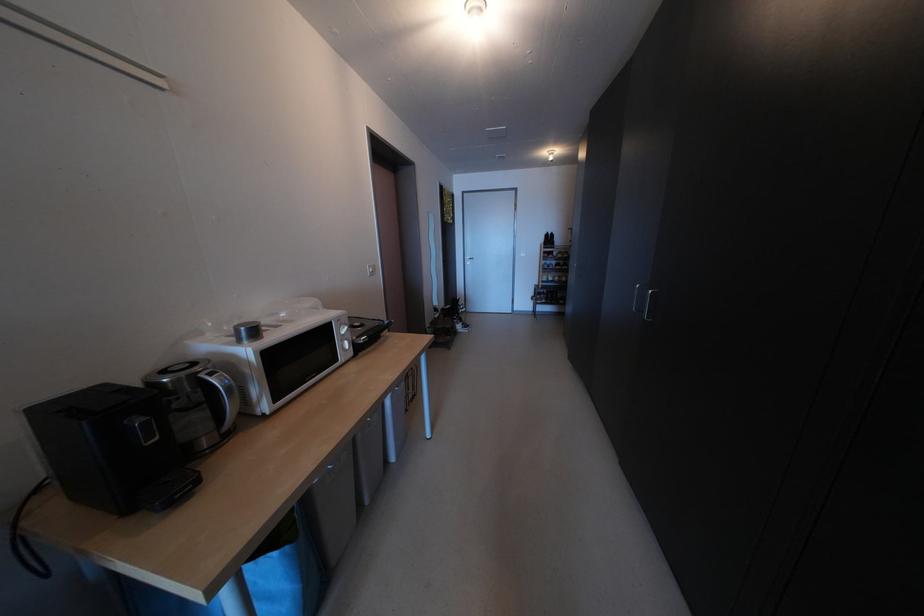
This screenshot has height=616, width=924. What are the coordinates of `white microwave dial` in the screenshot? It's located at (346, 345).